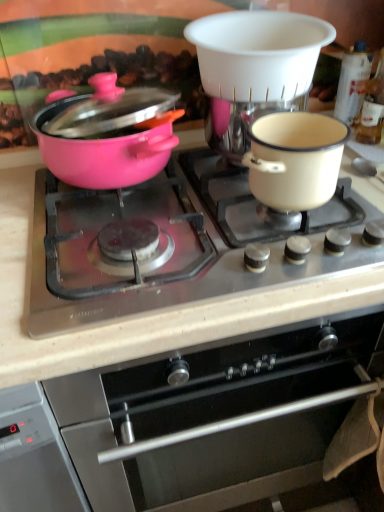
Question: From the image's perspective, is pink glossy pot at left positioned above or below matte black cooktop at center?

Choices:
 (A) above
 (B) below

Answer: (A)

Question: Considering the positions of pink glossy pot at left and matte black cooktop at center in the image, is pink glossy pot at left taller or shorter than matte black cooktop at center?

Choices:
 (A) short
 (B) tall

Answer: (B)

Question: Considering the real-world distances, which object is closest to the pink glossy pot at left?

Choices:
 (A) cream enamel pot at right
 (B) white plastic coffee machine at upper center
 (C) stainless steel oven at center
 (D) matte black cooktop at center

Answer: (D)

Question: Estimate the real-world distances between objects in this image. Which object is closer to the cream enamel pot at right?

Choices:
 (A) white plastic coffee machine at upper center
 (B) stainless steel oven at center
 (C) matte black cooktop at center
 (D) pink glossy pot at left

Answer: (A)